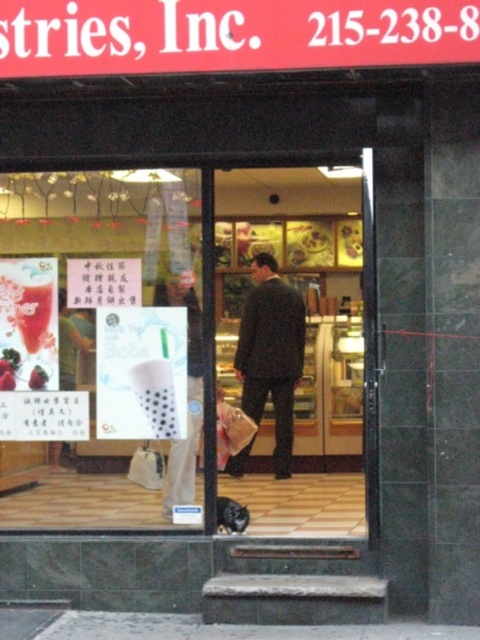
You are a customer entering the store and see the dark wool suit at center and the smooth matte strawberry at lower left. Which object is taller?

The dark wool suit at center is taller than the smooth matte strawberry at lower left.

You are a customer at the store and you want to pick up both the matte plastic bag at center and the white fabric shopping bag at lower center. Which one should you reach for first to get the one that is lower?

The white fabric shopping bag at lower center is lower than the matte plastic bag at center, so you should reach for the white fabric shopping bag at lower center first.

You are standing in front of the Stries, Inc. storefront and want to locate two specific points marked on the image. The first point is at coordinate point (303, 307) and the second is at coordinate point (29, 385). Which point is closer to you?

Point (303, 307) is further to the viewer than point (29, 385), so the second point is closer to you.